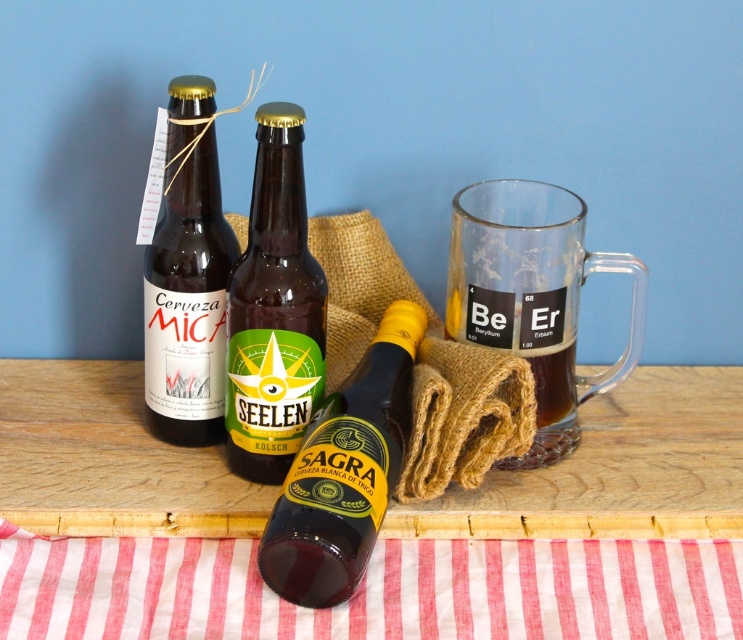
You are a barista setting up a table for an event. You have a red striped fabric at lower center and a green matte bottle at center. Which item is positioned closer to the front of the table?

The red striped fabric at lower center is closer to the viewer than the green matte bottle at center, so it is positioned closer to the front of the table.

You are setting up a table for a party and need to place a decorative item on top of the green matte bottle at center. Can you put the red striped fabric at lower center there?

The red striped fabric at lower center is positioned under the green matte bottle at center, so it cannot be placed on top of it since it is already underneath.